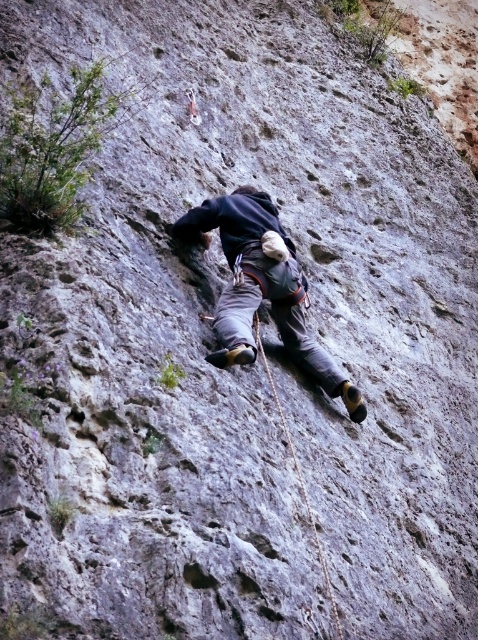
Can you confirm if dark gray fabric climbing harness at center is thinner than rope at center?

Yes, dark gray fabric climbing harness at center is thinner than rope at center.

Is dark gray fabric climbing harness at center shorter than rope at center?

Correct, dark gray fabric climbing harness at center is not as tall as rope at center.

Who is more distant from viewer, (275, 216) or (310, 515)?

Point (275, 216)

This screenshot has width=478, height=640. What are the coordinates of `dark gray fabric climbing harness at center` in the screenshot? It's located at (262, 289).